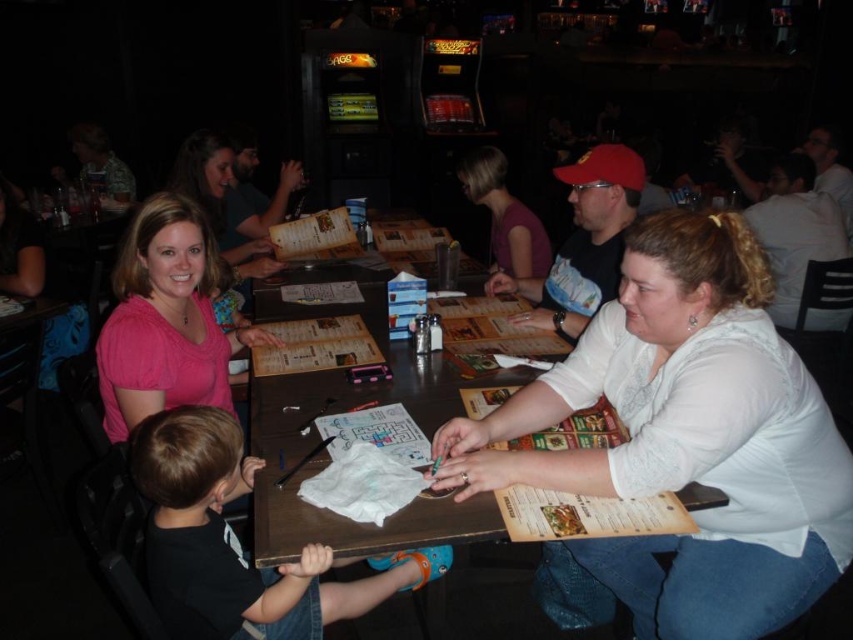
Question: Which point is farther to the camera?

Choices:
 (A) (815, 310)
 (B) (143, 292)
 (C) (265, 614)
 (D) (567, 280)

Answer: (A)

Question: Does black cotton shirt at lower left appear under purple matte shirt at upper center?

Choices:
 (A) yes
 (B) no

Answer: (A)

Question: Which object is closer to the camera taking this photo?

Choices:
 (A) white matte shirt at upper right
 (B) pink matte shirt at upper left

Answer: (B)

Question: Does pink matte shirt at upper left have a smaller size compared to matte black shirt at center?

Choices:
 (A) no
 (B) yes

Answer: (B)

Question: Estimate the real-world distances between objects in this image. Which object is closer to the matte black shirt at center?

Choices:
 (A) black cotton shirt at lower left
 (B) pink matte shirt at upper left

Answer: (B)

Question: Is white lace shirt at center positioned before black cotton shirt at lower left?

Choices:
 (A) no
 (B) yes

Answer: (A)